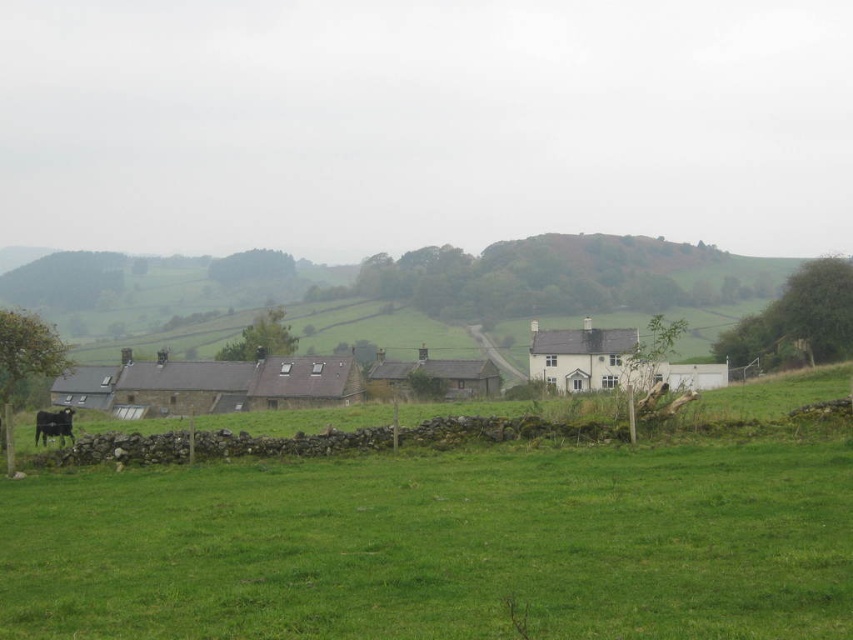
Question: In this image, where is green grass at center located relative to black fur at lower left?

Choices:
 (A) below
 (B) above

Answer: (B)

Question: Which of the following is the closest to the observer?

Choices:
 (A) black fur at lower left
 (B) green grass at center

Answer: (B)

Question: Does green grass at center lie in front of black fur at lower left?

Choices:
 (A) no
 (B) yes

Answer: (B)

Question: In this image, where is green grass at center located relative to black fur at lower left?

Choices:
 (A) below
 (B) above

Answer: (B)

Question: Among these points, which one is nearest to the camera?

Choices:
 (A) (62, 408)
 (B) (701, 589)

Answer: (B)